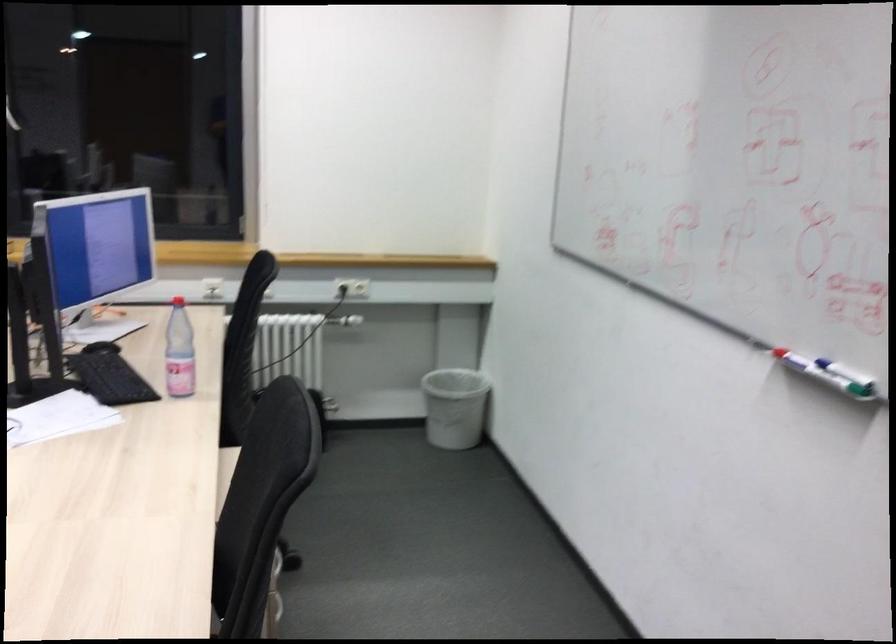
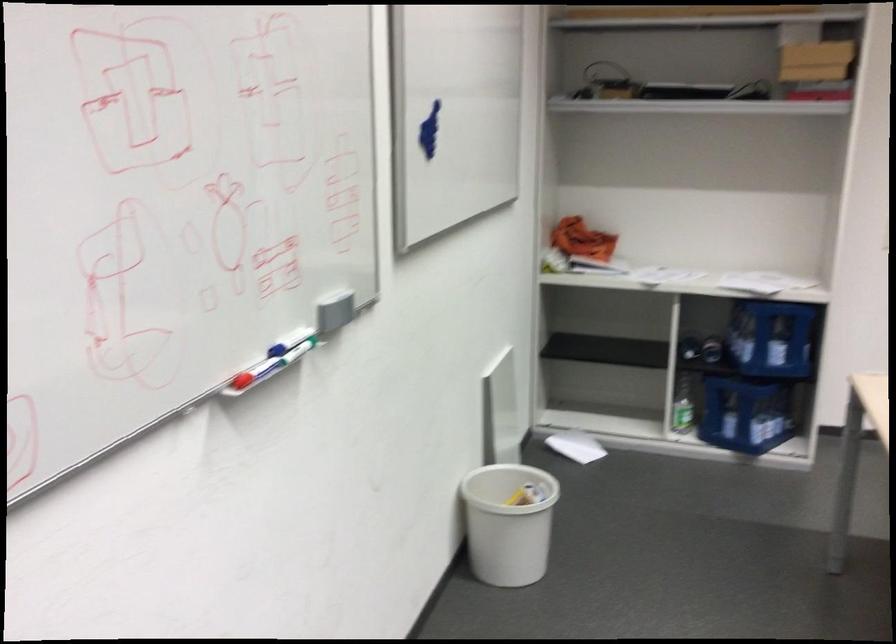
Question: I am providing you with two images of the same scene from different viewpoints. Please identify which objects are invisible in image2.

Choices:
 (A) grey whiteboard eraser
 (B) clear plastic bin
 (C) whiteboard marker
 (D) blue bottle crate

Answer: (C)